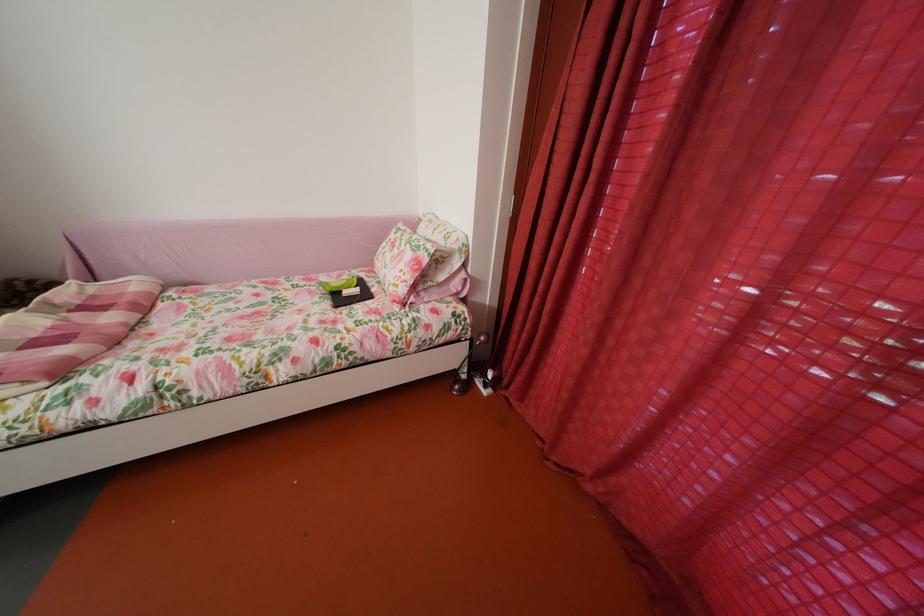
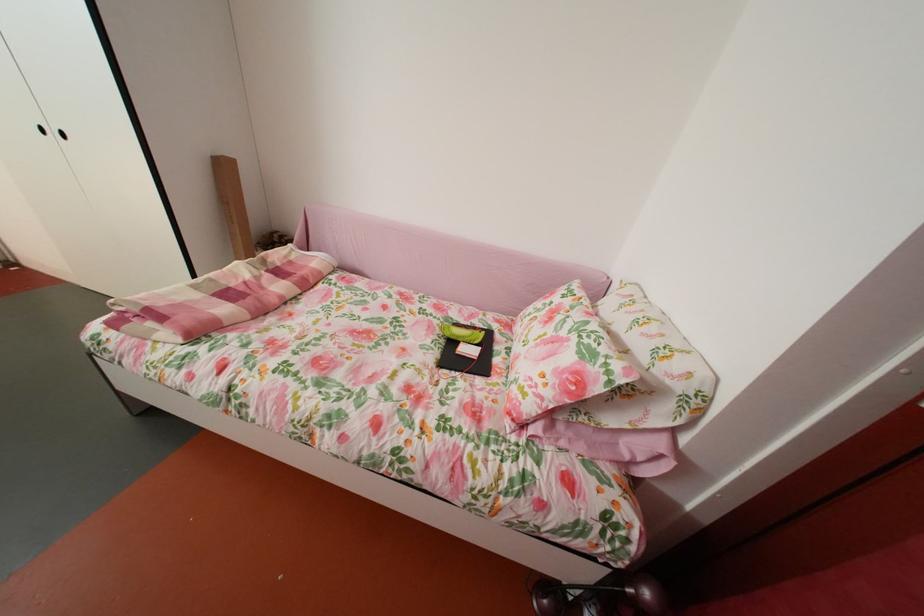
The point at [77,321] is marked in the first image. Where is the corresponding point in the second image?

(274, 278)